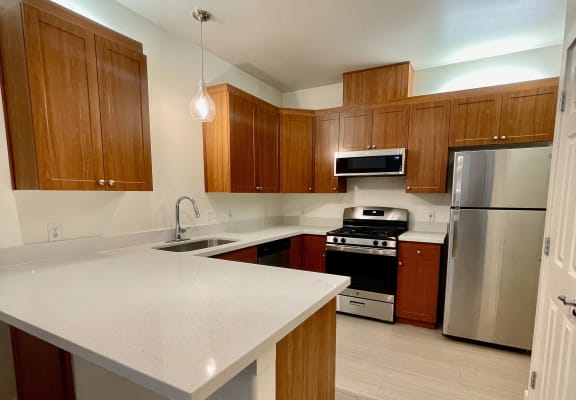
I want to click on oven, so click(367, 264).